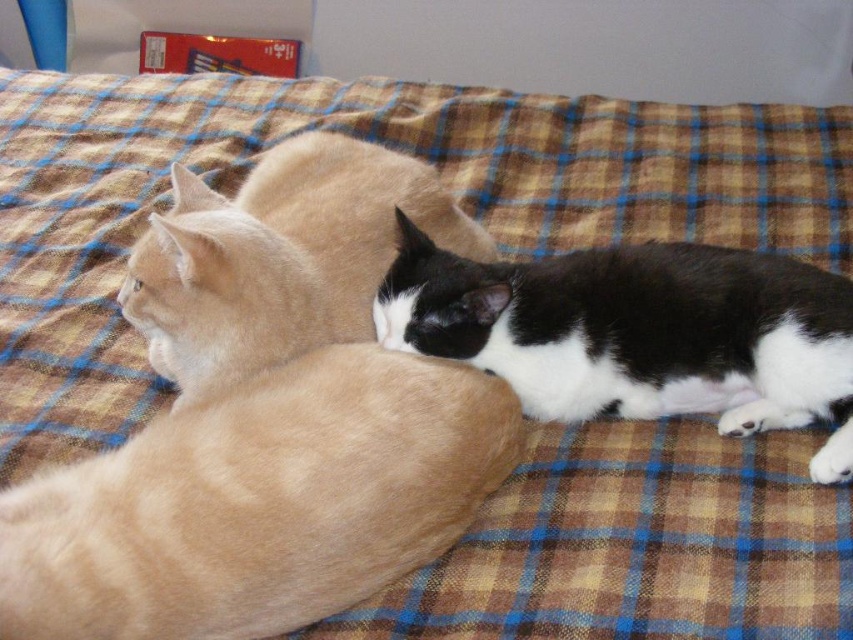
Question: Can you confirm if fluffy beige cat at center is wider than black and white fur cat at center?

Choices:
 (A) yes
 (B) no

Answer: (B)

Question: Can you confirm if fluffy beige cat at center is wider than black and white fur cat at center?

Choices:
 (A) no
 (B) yes

Answer: (A)

Question: Which point appears closest to the camera in this image?

Choices:
 (A) (524, 376)
 (B) (79, 468)

Answer: (B)

Question: Can you confirm if fluffy beige cat at center is positioned to the right of black and white fur cat at center?

Choices:
 (A) yes
 (B) no

Answer: (B)

Question: Which object appears farthest from the camera in this image?

Choices:
 (A) fluffy beige cat at center
 (B) black and white fur cat at center

Answer: (B)